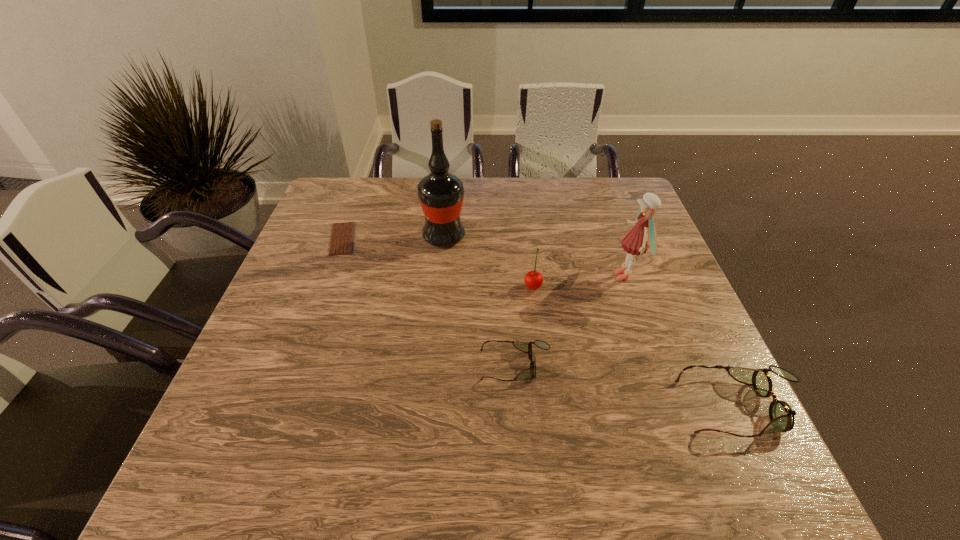
Identify the location of empty space between the doll and the leftmost object. (484, 257).

Where is `vacant area that lies between the leftmost object and the right spectacles`? The width and height of the screenshot is (960, 540). vacant area that lies between the leftmost object and the right spectacles is located at coordinates (541, 323).

You are a GUI agent. You are given a task and a screenshot of the screen. Output one action in this format:
    pyautogui.click(x=<x>, y=<y>)
    Task: Click on the third closest object to the chocolate bar
    
    Given the screenshot: What is the action you would take?
    pyautogui.click(x=533, y=280)

Locate which object ranks third in proximity to the tallest object. Please provide its 2D coordinates. Your answer should be formatted as a tuple, i.e. [(x, y)], where the tuple contains the x and y coordinates of a point satisfying the conditions above.

[(526, 347)]

This screenshot has height=540, width=960. Find the location of `free space that satisfies the following two spatial constraints: 1. on the front side of the cherry; 2. on the left side of the tallest object`. free space that satisfies the following two spatial constraints: 1. on the front side of the cherry; 2. on the left side of the tallest object is located at coordinates (440, 286).